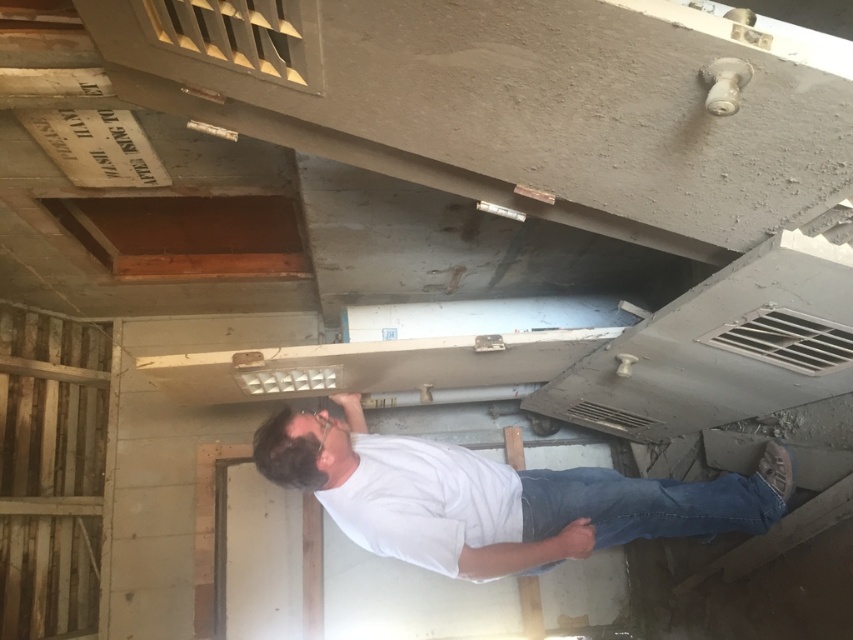
Question: Does white matte shirt at center appear over blue denim jeans at lower center?

Choices:
 (A) no
 (B) yes

Answer: (B)

Question: Can you confirm if white matte shirt at center is positioned above blue denim jeans at lower center?

Choices:
 (A) no
 (B) yes

Answer: (B)

Question: Where is white matte shirt at center located in relation to blue denim jeans at lower center in the image?

Choices:
 (A) above
 (B) below

Answer: (A)

Question: Among these objects, which one is farthest from the camera?

Choices:
 (A) white matte shirt at center
 (B) blue denim jeans at lower center

Answer: (B)